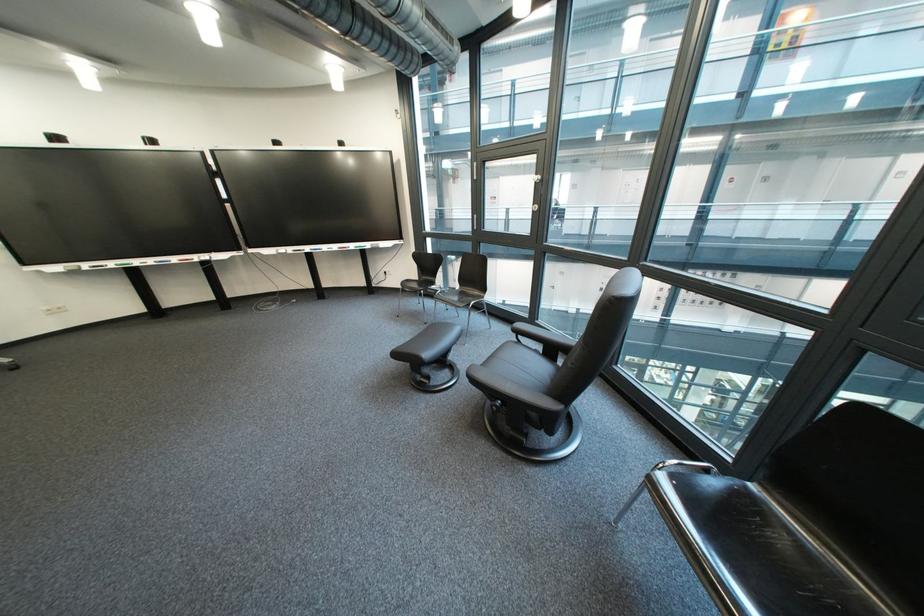
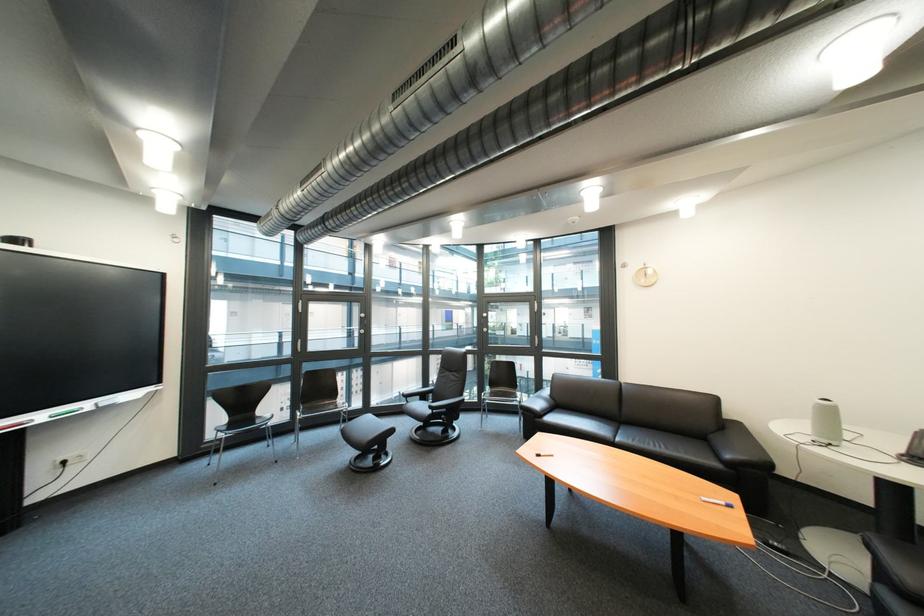
Find the pixel in the second image that matches (x=718, y=209) in the first image.

(363, 331)